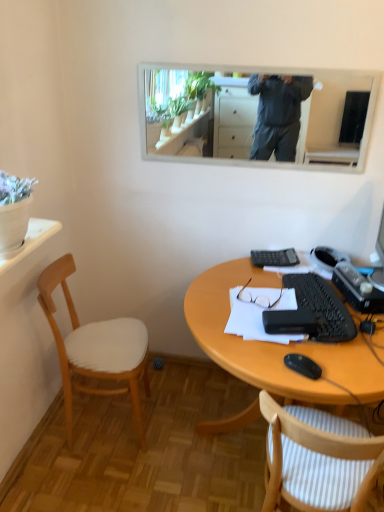
Image resolution: width=384 pixels, height=512 pixels. What are the coordinates of `free space in front of black plastic keyboard at center right` in the screenshot? It's located at (325, 358).